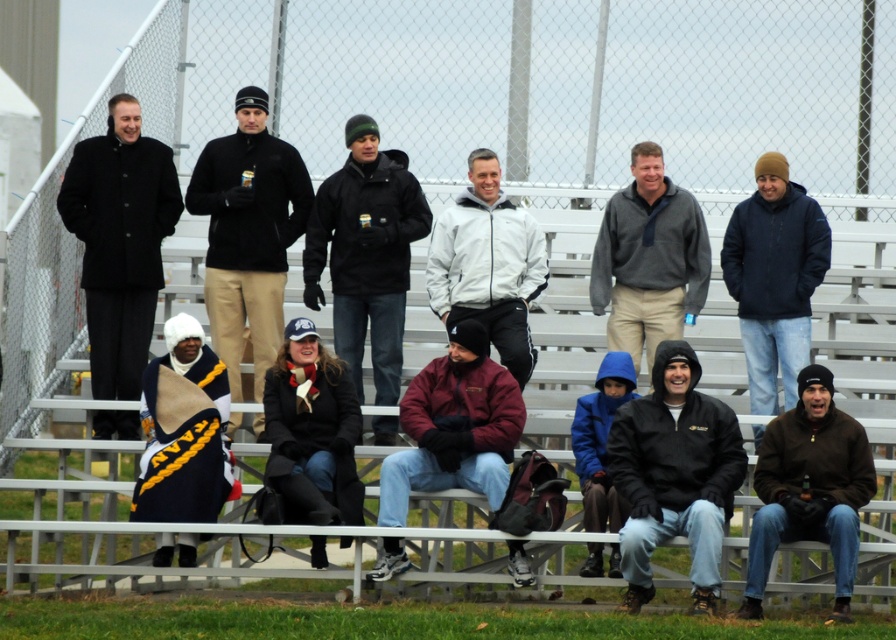
You are standing at the point marked as point [366,253] in the image. What object are you currently standing on?

The point [366,253] is on the dark gray fleece jacket at center.

You are a photographer positioned at the front of the bleachers. You want to capture a photo that includes both the dark blue jacket at right and the white matte jacket at center. Based on their positions, which jacket should you focus on first to ensure both are in the frame?

The dark blue jacket at right is below the white matte jacket at center. To include both in the frame, focus on the white matte jacket at center first as it is higher up, then adjust to ensure the dark blue jacket at right is also visible below it.

You are standing at the origin point of the coordinate system in the image. You see a point marked at coordinate point (x=119, y=241). Which object is this point located on?

The point (x=119, y=241) is located on the black matte coat at left.